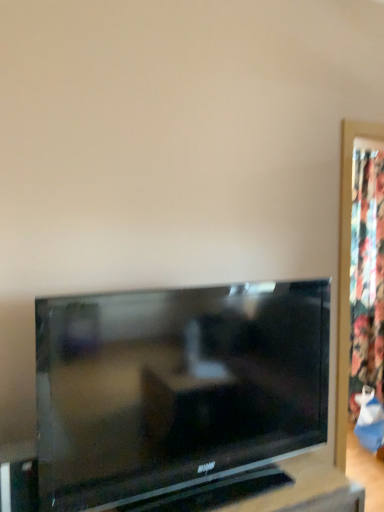
Question: In terms of size, does matte black tv at center appear bigger or smaller than floral fabric curtain at right?

Choices:
 (A) small
 (B) big

Answer: (A)

Question: In the image, is matte black tv at center positioned in front of or behind floral fabric curtain at right?

Choices:
 (A) behind
 (B) front

Answer: (B)

Question: Is point (144, 452) closer or farther from the camera than point (354, 267)?

Choices:
 (A) farther
 (B) closer

Answer: (B)

Question: From the image's perspective, relative to matte black tv at center, is floral fabric curtain at right above or below?

Choices:
 (A) below
 (B) above

Answer: (B)

Question: Is point (380, 306) positioned closer to the camera than point (249, 354)?

Choices:
 (A) closer
 (B) farther

Answer: (B)

Question: Looking at the image, does floral fabric curtain at right seem bigger or smaller compared to matte black tv at center?

Choices:
 (A) small
 (B) big

Answer: (B)

Question: In terms of height, does floral fabric curtain at right look taller or shorter compared to matte black tv at center?

Choices:
 (A) short
 (B) tall

Answer: (B)